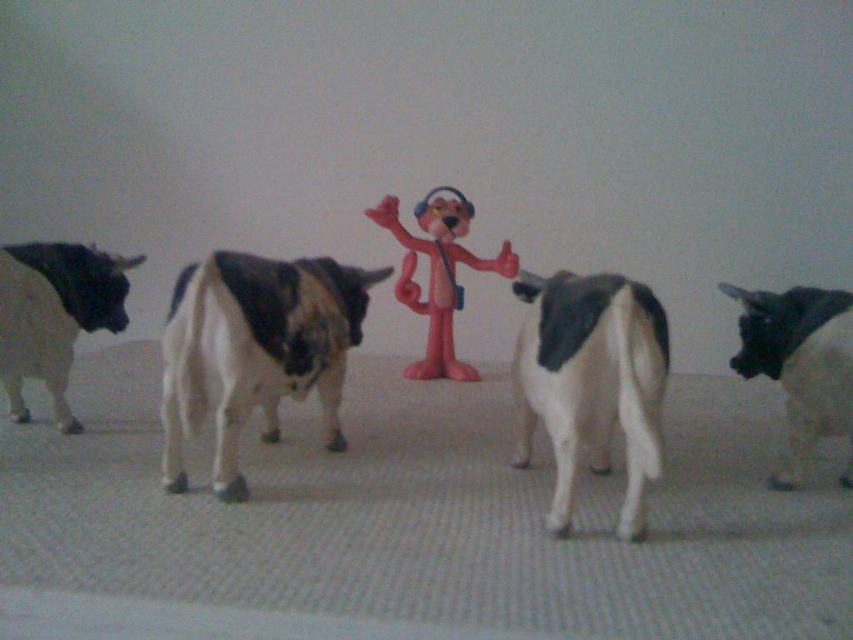
The image size is (853, 640). Describe the element at coordinates (592, 384) in the screenshot. I see `black and white plastic cow at center` at that location.

Which of these two, black and white plastic cow at center or black glossy bull at right, stands shorter?

With less height is black glossy bull at right.

Is point (595, 400) closer to camera compared to point (840, 387)?

That is True.

Locate an element on the screen. This screenshot has width=853, height=640. black and white plastic cow at center is located at coordinates pyautogui.click(x=592, y=384).

Can you confirm if black and white plastic bull at center is wider than pink plastic toy at center?

Yes, black and white plastic bull at center is wider than pink plastic toy at center.

Which is in front, point (173, 305) or point (450, 332)?

Positioned in front is point (173, 305).

The image size is (853, 640). What do you see at coordinates (254, 349) in the screenshot?
I see `black and white plastic bull at center` at bounding box center [254, 349].

You are a GUI agent. You are given a task and a screenshot of the screen. Output one action in this format:
    pyautogui.click(x=<x>, y=<y>)
    Task: Click on the black and white plastic bull at center
    The image size is (853, 640).
    Given the screenshot: What is the action you would take?
    [x=254, y=349]

Does black and white plastic cow at center appear over pink plastic toy at center?

No.

Is black and white plastic cow at center positioned in front of pink plastic toy at center?

That is True.

The image size is (853, 640). I want to click on black and white plastic cow at center, so click(592, 384).

Identify the location of black and white plastic cow at center. The image size is (853, 640). (592, 384).